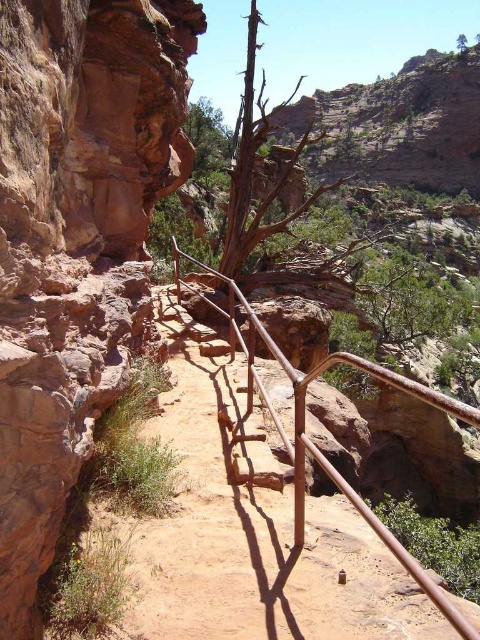
Question: Which object is closer to the camera taking this photo?

Choices:
 (A) rustic stone cliff at left
 (B) rusty metal rail at center

Answer: (B)

Question: In this image, where is rustic stone cliff at left located relative to rusty metal rail at center?

Choices:
 (A) right
 (B) left

Answer: (B)

Question: Is rustic stone cliff at left further to the viewer compared to rusty metal rail at center?

Choices:
 (A) yes
 (B) no

Answer: (A)

Question: Can you confirm if rustic stone cliff at left is bigger than rusty metal rail at center?

Choices:
 (A) no
 (B) yes

Answer: (A)

Question: Which point is farther from the camera taking this photo?

Choices:
 (A) (195, 260)
 (B) (95, 209)

Answer: (A)